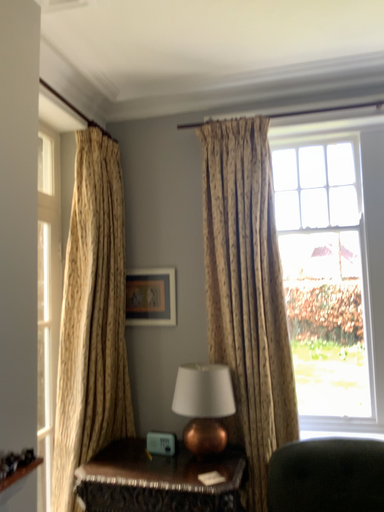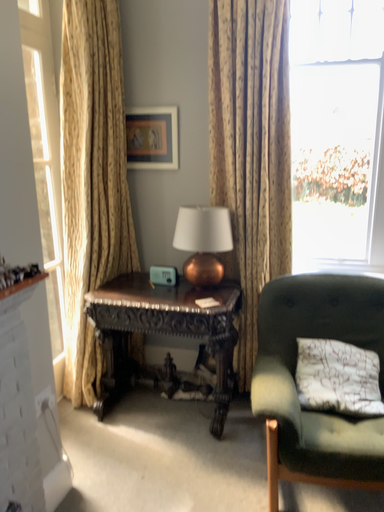
Question: Which way did the camera rotate in the video?

Choices:
 (A) rotated downward
 (B) rotated upward

Answer: (A)